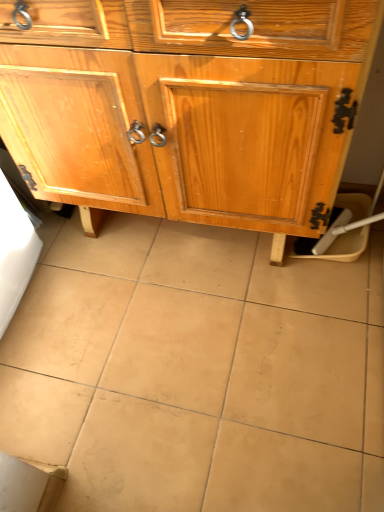
What do you see at coordinates (196, 371) in the screenshot? This screenshot has height=512, width=384. I see `beige ceramic tile at center` at bounding box center [196, 371].

The image size is (384, 512). I want to click on beige ceramic tile at center, so click(x=196, y=371).

Describe the element at coordinates (184, 103) in the screenshot. This screenshot has width=384, height=512. I see `wooden cabinet at center` at that location.

Locate an element on the screen. wooden cabinet at center is located at coordinates (184, 103).

The image size is (384, 512). Identify the location of beige ceramic tile at center. click(196, 371).

Which is more to the right, beige ceramic tile at center or wooden cabinet at center?

wooden cabinet at center is more to the right.

Which is in front, beige ceramic tile at center or wooden cabinet at center?

wooden cabinet at center.

Between point (80, 407) and point (98, 152), which one is positioned behind?

The point (80, 407) is more distant.

From the image's perspective, is beige ceramic tile at center above or below wooden cabinet at center?

Clearly, from the image's perspective, beige ceramic tile at center is below wooden cabinet at center.

Consider the image. From a real-world perspective, is beige ceramic tile at center physically located above or below wooden cabinet at center?

Clearly, from a real-world perspective, beige ceramic tile at center is below wooden cabinet at center.

Between beige ceramic tile at center and wooden cabinet at center, which one has smaller width?

Thinner between the two is wooden cabinet at center.

Considering the relative sizes of beige ceramic tile at center and wooden cabinet at center in the image provided, is beige ceramic tile at center taller than wooden cabinet at center?

Incorrect, the height of beige ceramic tile at center is not larger of that of wooden cabinet at center.

Looking at the image, does beige ceramic tile at center seem bigger or smaller compared to wooden cabinet at center?

Clearly, beige ceramic tile at center is smaller in size than wooden cabinet at center.

Is wooden cabinet at center inside beige ceramic tile at center?

No, wooden cabinet at center is not inside beige ceramic tile at center.

Are beige ceramic tile at center and wooden cabinet at center located far from each other?

No, beige ceramic tile at center is not far away from wooden cabinet at center.

Is beige ceramic tile at center facing towards wooden cabinet at center?

No.

How different are the orientations of beige ceramic tile at center and wooden cabinet at center in degrees?

The angular difference between beige ceramic tile at center and wooden cabinet at center is 0.433 degrees.

How far apart are beige ceramic tile at center and wooden cabinet at center?

They are 17.19 inches apart.

Image resolution: width=384 pixels, height=512 pixels. In order to click on chest of drawers on the right of beige ceramic tile at center in this screenshot , I will do `click(184, 103)`.

Does wooden cabinet at center appear on the left side of beige ceramic tile at center?

In fact, wooden cabinet at center is to the right of beige ceramic tile at center.

Does wooden cabinet at center come behind beige ceramic tile at center?

That is False.

Which point is more forward, (100, 102) or (125, 398)?

The point (100, 102) is closer.

From the image's perspective, which is above, wooden cabinet at center or beige ceramic tile at center?

wooden cabinet at center appears higher in the image.

From a real-world perspective, is wooden cabinet at center above or below beige ceramic tile at center?

In terms of real-world spatial position, wooden cabinet at center is above beige ceramic tile at center.

Is wooden cabinet at center thinner than beige ceramic tile at center?

Correct, the width of wooden cabinet at center is less than that of beige ceramic tile at center.

Considering the relative sizes of wooden cabinet at center and beige ceramic tile at center in the image provided, is wooden cabinet at center taller than beige ceramic tile at center?

Yes.

Considering the sizes of objects wooden cabinet at center and beige ceramic tile at center in the image provided, who is smaller, wooden cabinet at center or beige ceramic tile at center?

beige ceramic tile at center is smaller.

Is wooden cabinet at center surrounding beige ceramic tile at center?

That's incorrect, beige ceramic tile at center is not inside wooden cabinet at center.

Are wooden cabinet at center and beige ceramic tile at center beside each other?

No.

Is wooden cabinet at center oriented away from beige ceramic tile at center?

No, beige ceramic tile at center is not at the back of wooden cabinet at center.

Looking at this image, how different are the orientations of wooden cabinet at center and beige ceramic tile at center in degrees?

wooden cabinet at center and beige ceramic tile at center are facing 0.433 degrees away from each other.

Based on the photo, how far apart are wooden cabinet at center and beige ceramic tile at center?

The distance of wooden cabinet at center from beige ceramic tile at center is 43.66 centimeters.

Where is `the chest of drawers located in front of the beige ceramic tile at center`? the chest of drawers located in front of the beige ceramic tile at center is located at coordinates (184, 103).

What are the coordinates of `chest of drawers in front of the beige ceramic tile at center` in the screenshot? It's located at (184, 103).

I want to click on chest of drawers above the beige ceramic tile at center (from the image's perspective), so click(x=184, y=103).